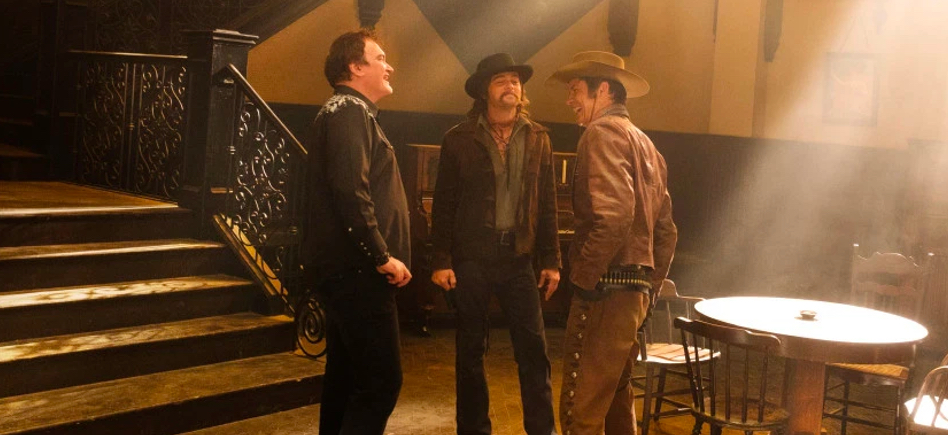
At what (x,y) coordinates should I click in order to perform the action: click on picture on wall. Please return your answer as a coordinate pair (x, y). The height and width of the screenshot is (435, 948). Looking at the image, I should click on (851, 99).